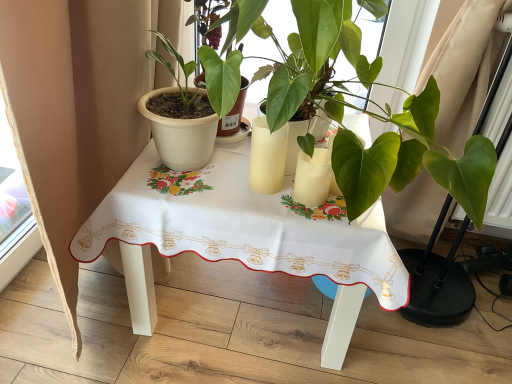
Where is `free spot in front of matte white pot at left, the first houseplant viewed from the left`? This screenshot has height=384, width=512. free spot in front of matte white pot at left, the first houseplant viewed from the left is located at coordinates coord(181,192).